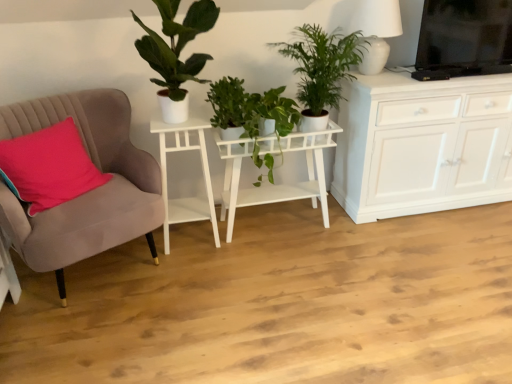
At what (x,y) coordinates should I click in order to perform the action: click on vacant space underneath suede armchair at left (from a real-world perspective). Please return your answer as a coordinate pair (x, y). Image resolution: width=512 pixels, height=384 pixels. Looking at the image, I should click on (106, 272).